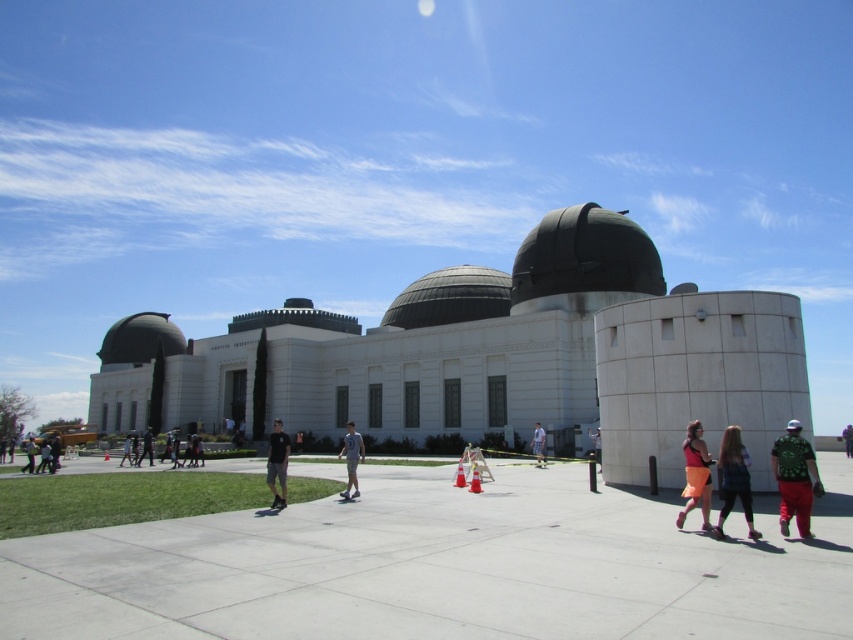
You are standing at the Griffith Observatory and want to take a photo of the two points marked in the image. Which point, point (131, 336) or point (845, 452), is closer to you when facing the observatory?

Point (845, 452) is closer to you because it is in front of point (131, 336).

You are a photographer at the Griffith Observatory plaza. You see a person wearing an orange skirt at lower right and another wearing green fabric shorts at center. Which clothing item appears smaller in the photo?

The orange skirt at lower right appears smaller compared to the green fabric shorts at center.

You are a photographer planning to capture a group photo of the people in the scene. You need to ensure that both the green printed shirt at lower right and the dark brown leather jacket at lower right are clearly visible in the photo. Given their sizes, which clothing item might you need to position closer to the camera to ensure visibility?

The green printed shirt at lower right has a smaller size compared to dark brown leather jacket at lower right. To ensure visibility, the green printed shirt at lower right should be positioned closer to the camera since it is smaller and might be less noticeable from a distance.